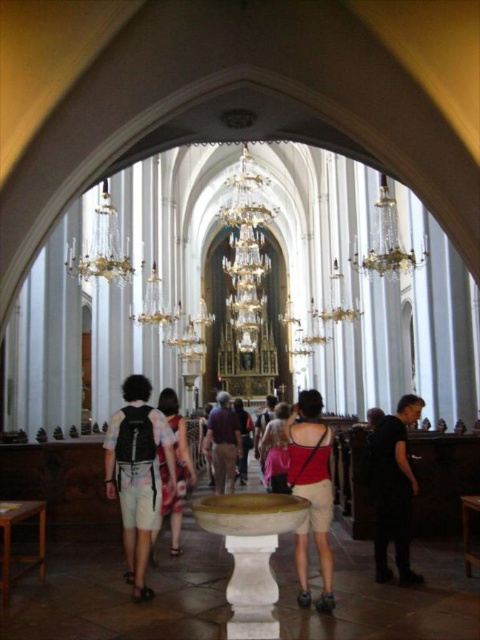
Question: Which of the following is the farthest from the observer?

Choices:
 (A) black backpack at center
 (B) dark brown leather backpack at center
 (C) crystal glass chandelier at center
 (D) black matte shirt at lower right

Answer: (B)

Question: Does red fabric tank top at center appear over white cotton dress at center?

Choices:
 (A) no
 (B) yes

Answer: (B)

Question: Which object is farther from the camera taking this photo?

Choices:
 (A) red fabric tank top at center
 (B) dark brown leather backpack at center
 (C) crystal glass chandelier at center

Answer: (B)

Question: Does black matte shirt at lower right have a greater width compared to dark brown leather backpack at center?

Choices:
 (A) yes
 (B) no

Answer: (A)

Question: Does black matte shirt at lower right have a smaller size compared to crystal glass chandelier at center?

Choices:
 (A) yes
 (B) no

Answer: (A)

Question: Which object is farther from the camera taking this photo?

Choices:
 (A) pink fabric dress at center
 (B) crystal glass chandelier at upper center
 (C) dark purple shirt at center
 (D) crystal glass chandelier at center

Answer: (C)